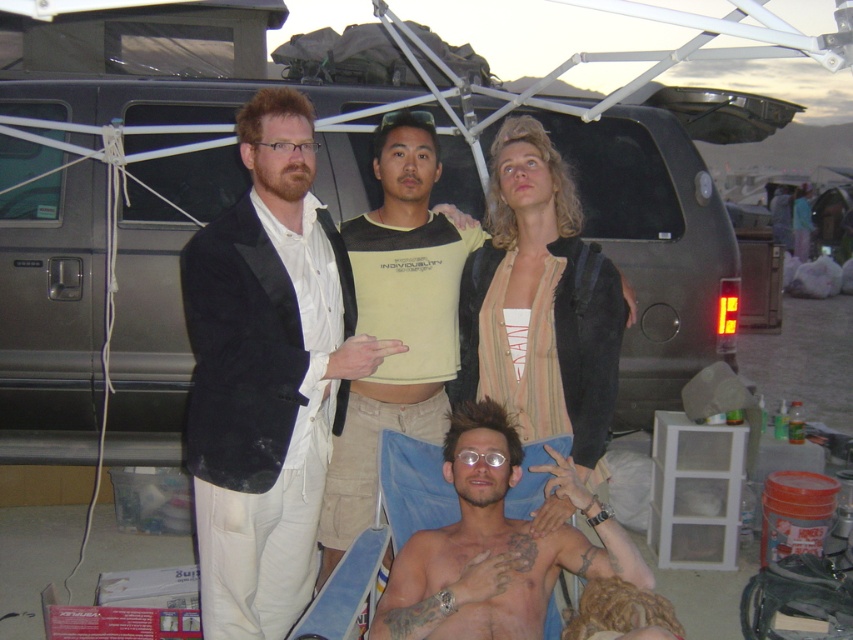
Based on the photo, you are standing in front of the group and want to take a photo. There are two points marked in the image. The first point is at coordinates point (x=74, y=369) and the second point is at point (x=450, y=588). Which point is closer to your camera?

Point (x=74, y=369) is closer to the camera than point (x=450, y=588).